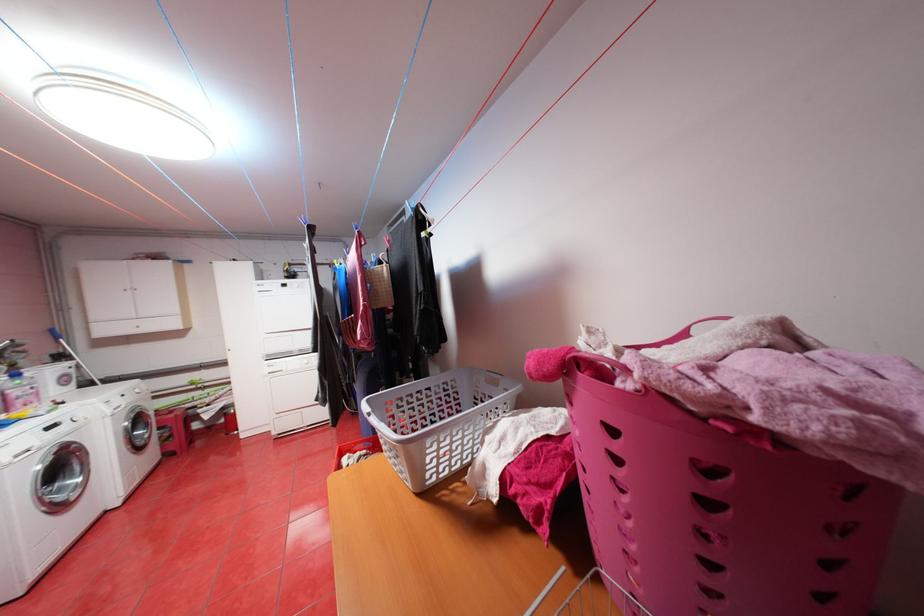
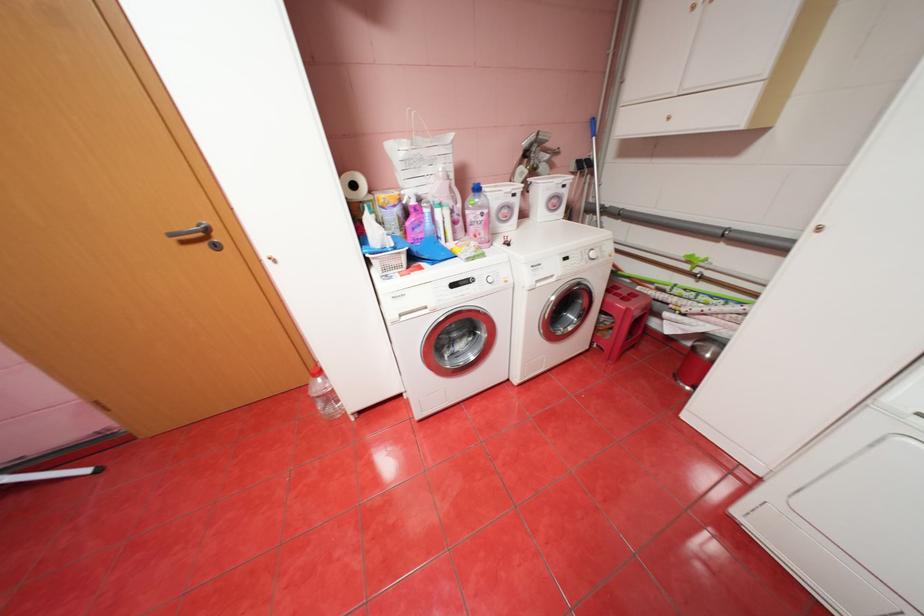
In the second image, find the point that corresponds to point (76, 376) in the first image.

(566, 197)